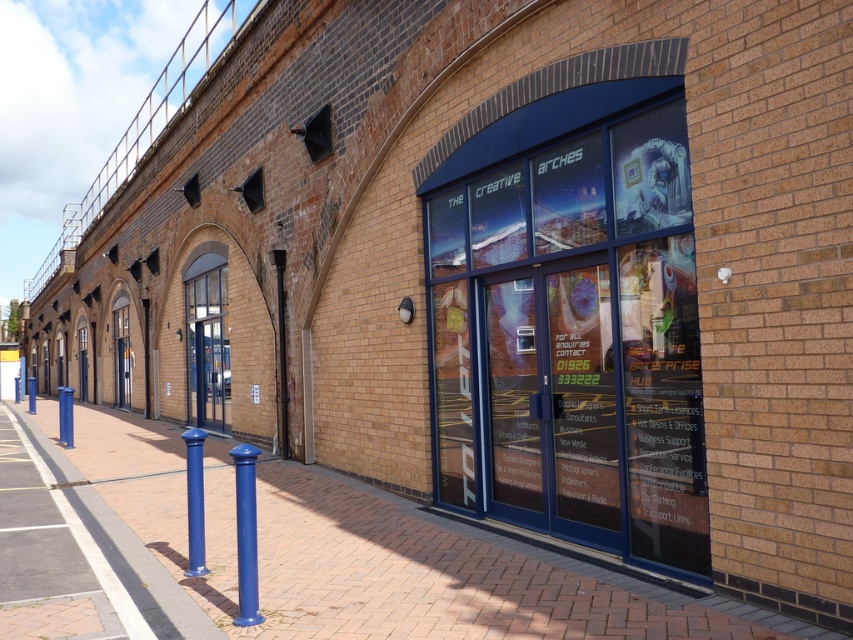
You are a delivery person trying to find the entrance to the building. You see the transparent glass storefront at center and the blue metallic pole at left. Which object is bigger and more likely to be the entrance?

The transparent glass storefront at center is larger than the blue metallic pole at left, so it is more likely to be the entrance.

You are a delivery person approaching the blue matte pole at center and the blue metallic pole at left. Which pole is closer to the building?

The blue metallic pole at left is closer to the building because the blue matte pole at center is positioned on the right side of it, meaning the blue metallic pole at left is between the building and the blue matte pole at center.

You are a delivery person trying to navigate through the area. You need to deliver a package to the transparent glass storefront at center. There is a blue matte pole at center in the way. Can you pass around the pole to reach the storefront?

The transparent glass storefront at center is larger than the blue matte pole at center, so yes, you can pass around the blue matte pole at center to reach the transparent glass storefront at center.